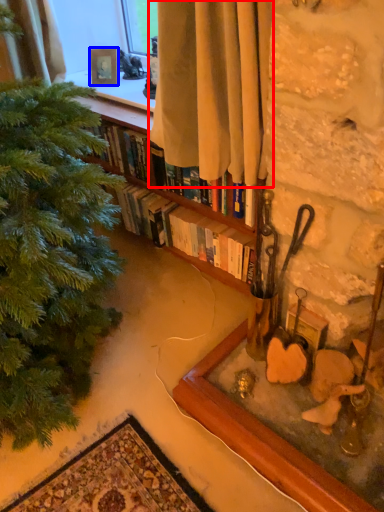
Question: Which of the following is the closest to the observer, curtain (highlighted by a red box) or picture frame (highlighted by a blue box)?

Choices:
 (A) curtain
 (B) picture frame

Answer: (A)